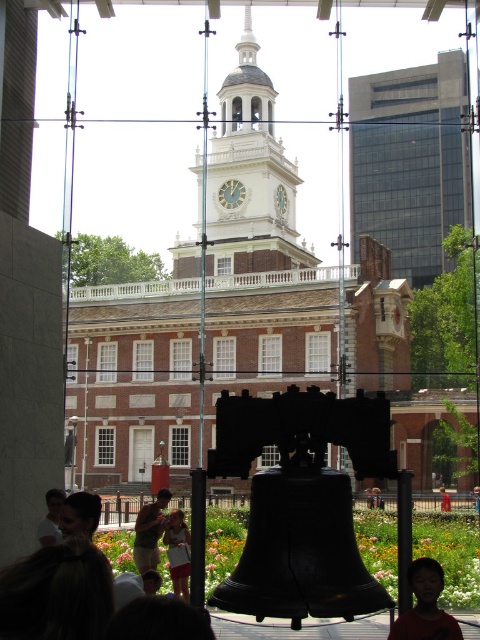
You are standing in front of the historic building and notice a tan cotton shirt at center and a light brown wooden chair at lower center. Which object is positioned to the left when viewed from your perspective?

The tan cotton shirt at center is to the left of the light brown wooden chair at lower center.

You are standing in a room with a window showing the Liberty Bell. You see a white cotton dress at center and a light brown wooden chair at center. Which object is closer to you?

The white cotton dress at center is closer to you because it is in front of the light brown wooden chair at center.

You are standing in front of the historic structure shown in the scene. You need to locate the tan cotton shirt at center. Where would you look relative to the black bell?

The tan cotton shirt at center is located at the coordinates point (149,531), which is to the right and slightly below the black bell in the foreground.